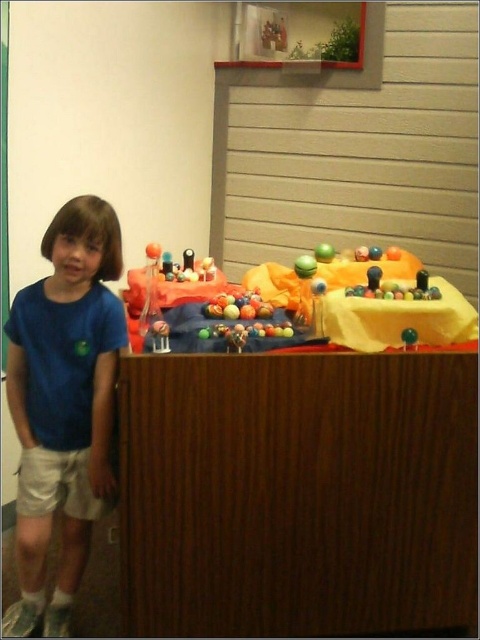
The user is trying to locate the white cotton shorts at lower left in the image. Based on the coordinates provided, can you confirm if the point marked at (57, 484) corresponds to their location?

Yes, the white cotton shorts at lower left is represented by point (57, 484).

The child is trying to reach for a toy on the table. The blue cotton shirt at left and white cotton shorts at lower left are part of the child. Which clothing item is closer to the toy if the toy is near the edge of the table?

The blue cotton shirt at left is closer to the toy because it is only 12.48 centimeters away from the white cotton shorts at lower left, implying it is positioned higher up on the child, closer to the table edge.

The child is playing with the glossy plastic balls at center. If the child moves closer to the white cotton shorts at lower left, will the balls become more visible or less visible?

The white cotton shorts at lower left is in front of the glossy plastic balls at center. Moving closer to the shorts would position the shorts between the viewer and the balls, potentially blocking the view, so the balls would become less visible.